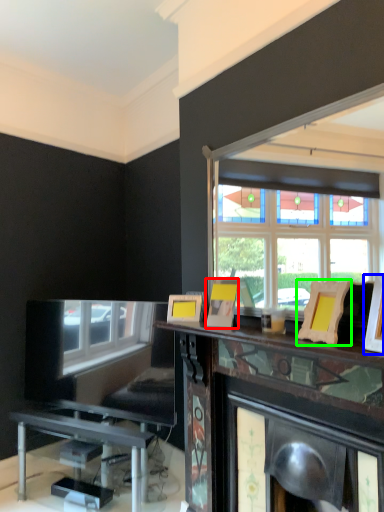
Question: Which object is positioned farthest from picture frame (highlighted by a red box)? Select from picture frame (highlighted by a blue box) and picture frame (highlighted by a green box).

Choices:
 (A) picture frame
 (B) picture frame

Answer: (A)